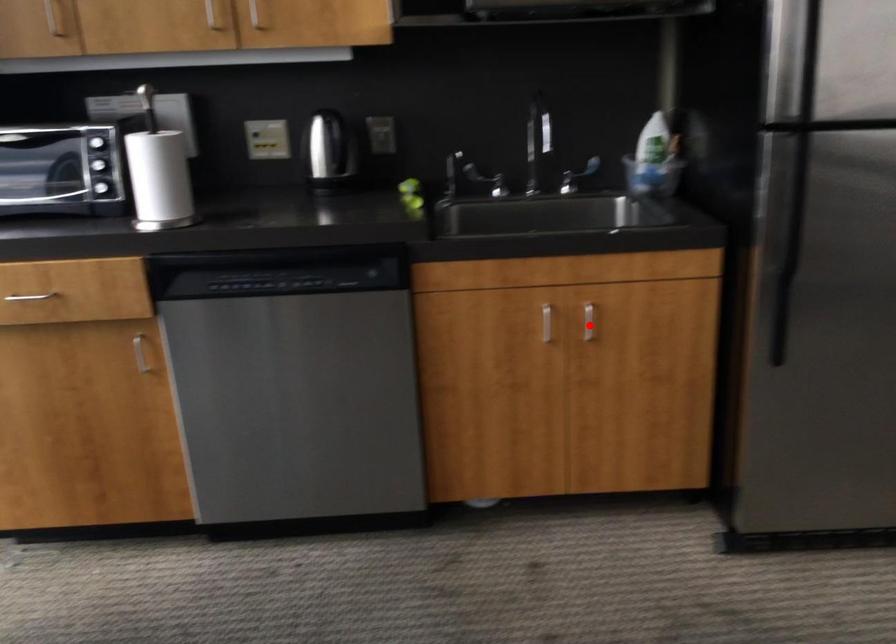
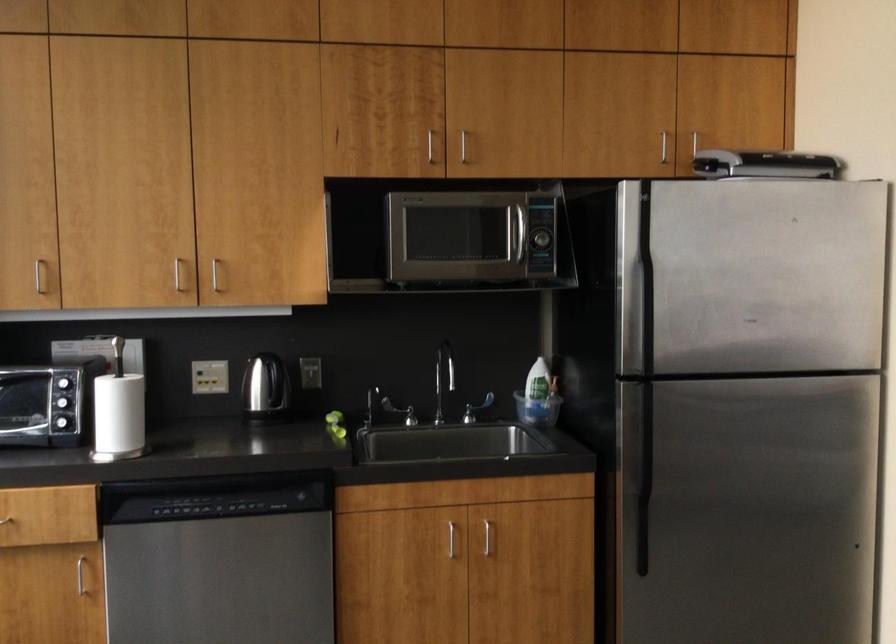
In the second image, find the point that corresponds to the highlighted location in the first image.

(490, 542)